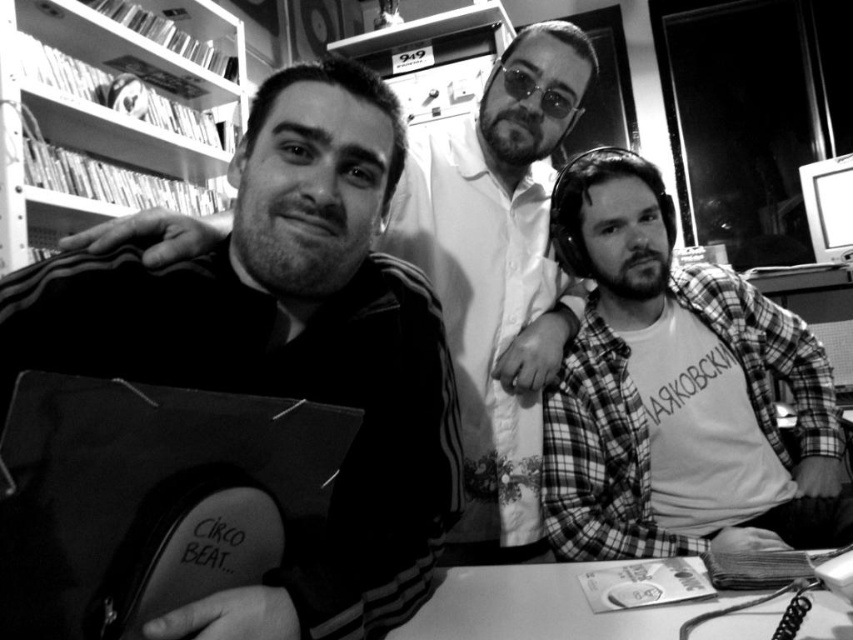
What do you see at coordinates (107, 120) in the screenshot? I see `metallic shelves at upper left` at bounding box center [107, 120].

The height and width of the screenshot is (640, 853). Identify the location of metallic shelves at upper left. point(107,120).

Who is more forward, (538,99) or (97,122)?

Point (538,99) is more forward.

Does smooth black jacket at left have a lesser width compared to metallic shelves at upper left?

Yes, smooth black jacket at left is thinner than metallic shelves at upper left.

Where is `smooth black jacket at left`? This screenshot has width=853, height=640. smooth black jacket at left is located at coordinates (498, 275).

From the picture: Does plaid shirt at right appear over smooth white table at lower center?

Correct, plaid shirt at right is located above smooth white table at lower center.

Does plaid shirt at right appear on the right side of smooth white table at lower center?

Correct, you'll find plaid shirt at right to the right of smooth white table at lower center.

Who is more distant from viewer, (764, 392) or (506, 604)?

Positioned behind is point (764, 392).

This screenshot has height=640, width=853. Identify the location of plaid shirt at right. (677, 392).